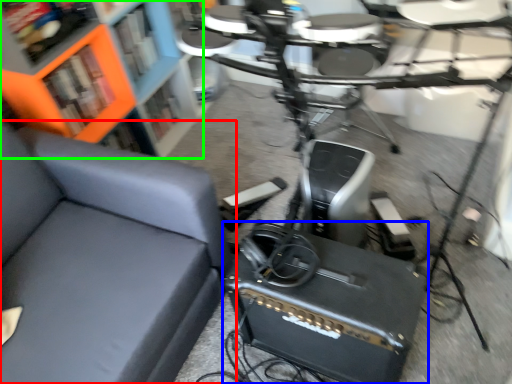
Question: Which is farther away from chair (highlighted by a red box)? speaker (highlighted by a blue box) or bookcase (highlighted by a green box)?

Choices:
 (A) speaker
 (B) bookcase

Answer: (B)